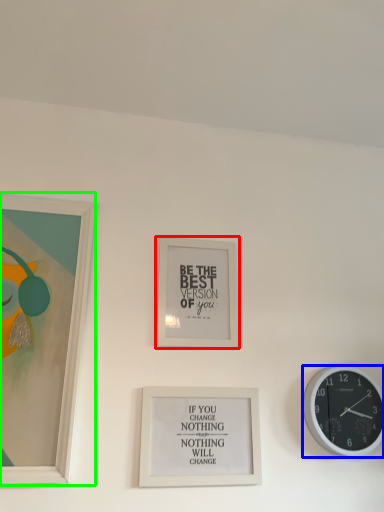
Question: Which object is positioned farthest from picture frame (highlighted by a red box)? Select from wall clock (highlighted by a blue box) and picture frame (highlighted by a green box).

Choices:
 (A) wall clock
 (B) picture frame

Answer: (A)